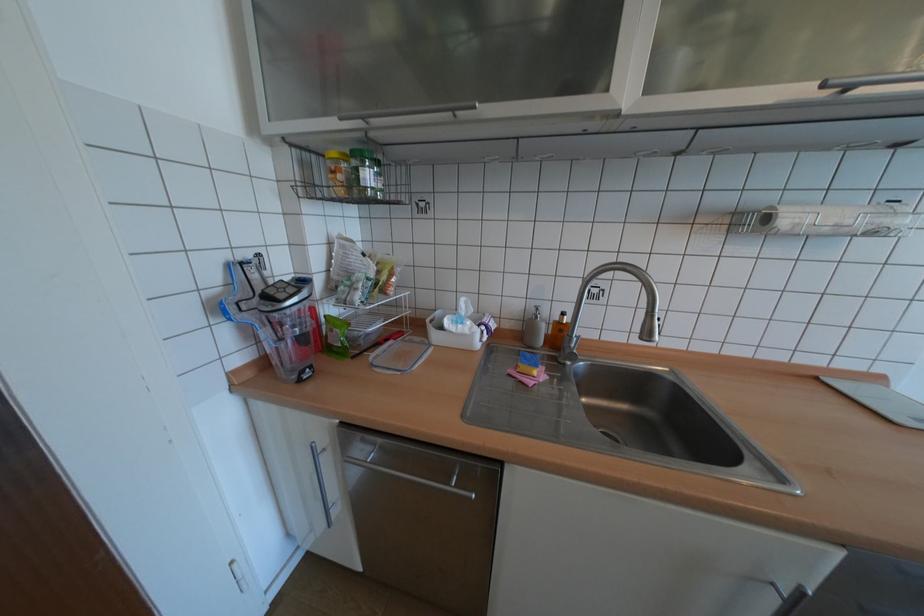
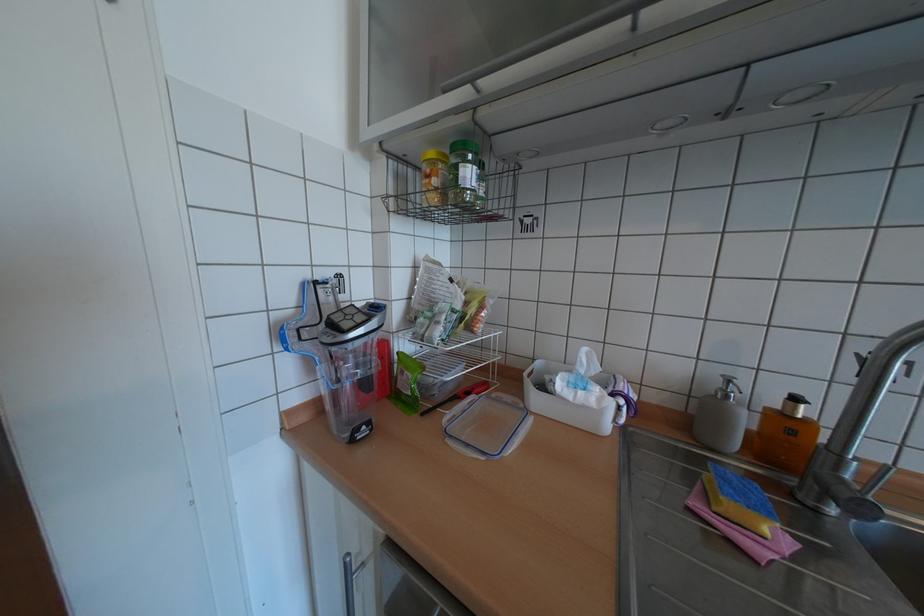
Find the pixel in the second image that matches point (578, 347) in the first image.

(852, 480)